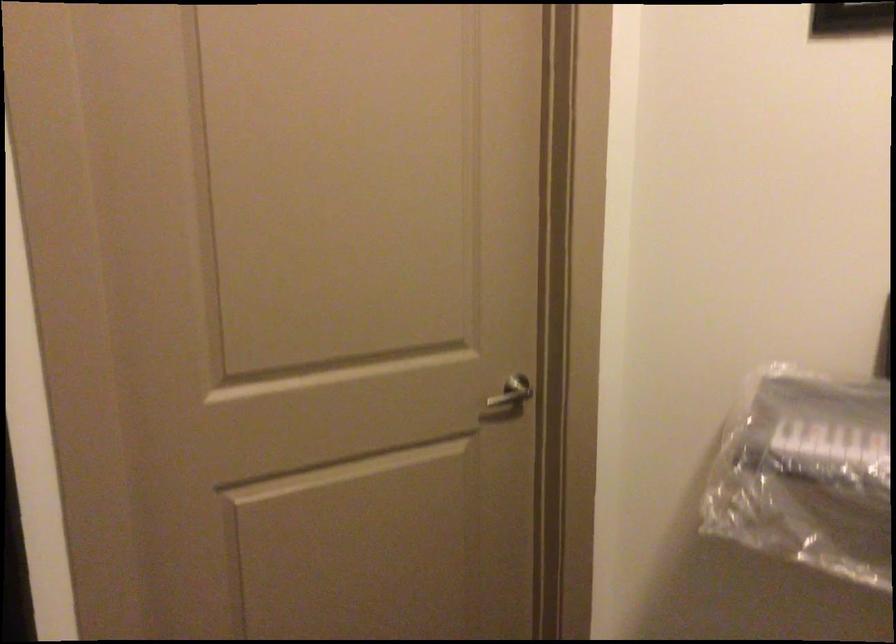
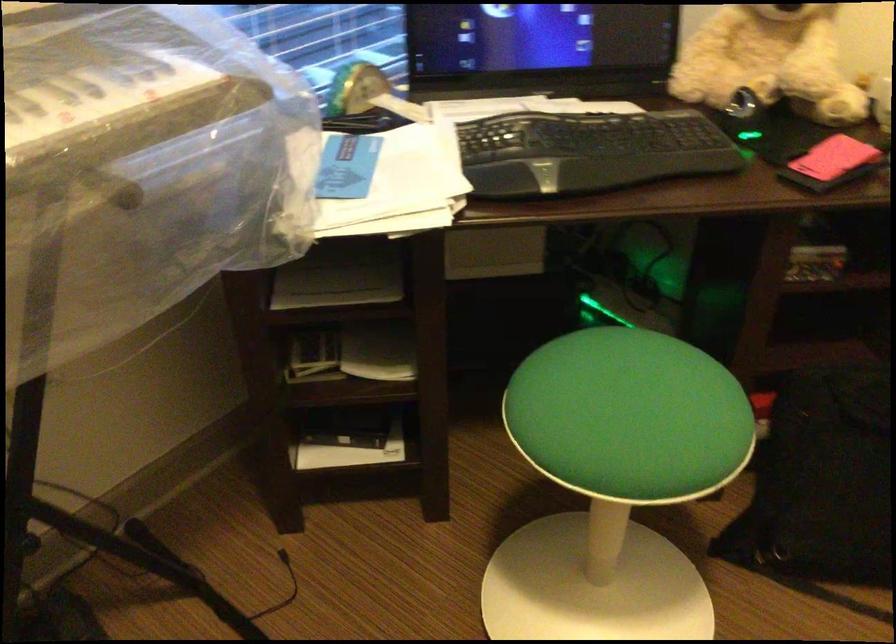
The images are taken continuously from a first-person perspective. In which direction is your viewpoint rotating?

The camera rotated toward right-down.